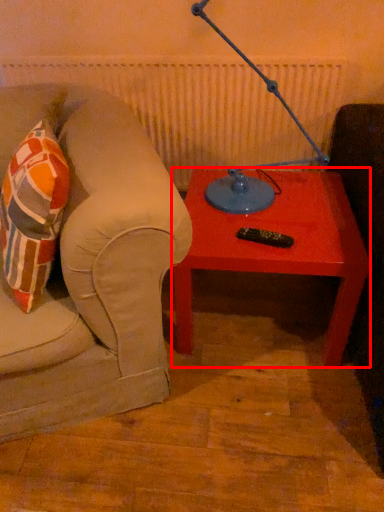
Question: Where is table (annotated by the red box) located in relation to table lamp in the image?

Choices:
 (A) left
 (B) right

Answer: (B)